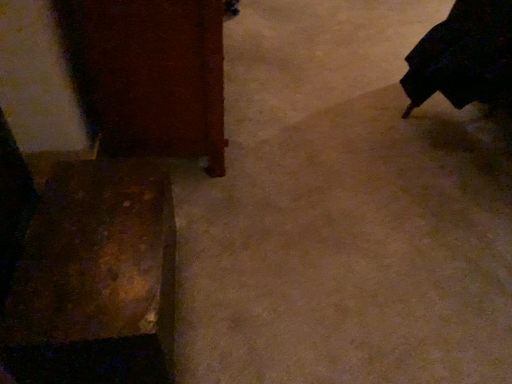
Question: Considering the positions of point (37, 317) and point (96, 59), is point (37, 317) closer or farther from the camera than point (96, 59)?

Choices:
 (A) closer
 (B) farther

Answer: (A)

Question: Considering the positions of rusty metal box at lower left, the first furniture when ordered from bottom to top, and wooden cabinet at left, arranged as the 2th furniture when ordered from the bottom, in the image, is rusty metal box at lower left, the first furniture when ordered from bottom to top, taller or shorter than wooden cabinet at left, arranged as the 2th furniture when ordered from the bottom,?

Choices:
 (A) tall
 (B) short

Answer: (B)

Question: Estimate the real-world distances between objects in this image. Which object is closer to the wooden cabinet at left, which is the first furniture from top to bottom?

Choices:
 (A) rusty metal box at lower left, the first furniture when ordered from bottom to top
 (B) black matte robe at right

Answer: (A)

Question: Based on their relative distances, which object is farther from the black matte robe at right?

Choices:
 (A) wooden cabinet at left, which is the first furniture from top to bottom
 (B) rusty metal box at lower left, the 2th furniture from the top

Answer: (B)